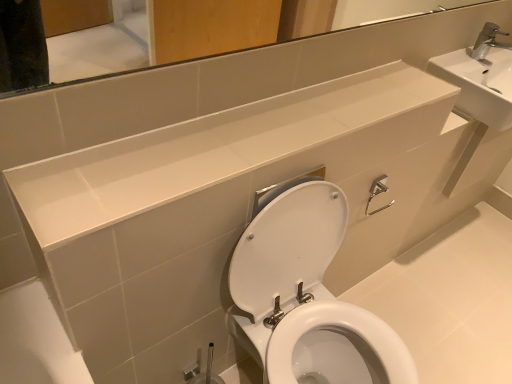
Question: Does white glossy toilet at center have a larger size compared to white glossy mirror at upper center?

Choices:
 (A) yes
 (B) no

Answer: (A)

Question: From a real-world perspective, is white glossy toilet at center positioned under white glossy mirror at upper center based on gravity?

Choices:
 (A) yes
 (B) no

Answer: (A)

Question: From the image's perspective, is white glossy toilet at center located beneath white glossy mirror at upper center?

Choices:
 (A) yes
 (B) no

Answer: (A)

Question: From the image's perspective, is white glossy toilet at center over white glossy mirror at upper center?

Choices:
 (A) no
 (B) yes

Answer: (A)

Question: Is white glossy toilet at center facing away from white glossy mirror at upper center?

Choices:
 (A) yes
 (B) no

Answer: (B)

Question: Is the position of white glossy toilet at center less distant than that of white glossy mirror at upper center?

Choices:
 (A) no
 (B) yes

Answer: (A)

Question: Does white glossy mirror at upper center appear on the left side of white glossy toilet at center?

Choices:
 (A) yes
 (B) no

Answer: (A)

Question: Is white glossy mirror at upper center placed right next to white glossy toilet at center?

Choices:
 (A) yes
 (B) no

Answer: (B)

Question: Is white glossy mirror at upper center positioned beyond the bounds of white glossy toilet at center?

Choices:
 (A) no
 (B) yes

Answer: (B)

Question: From a real-world perspective, is white glossy mirror at upper center on white glossy toilet at center?

Choices:
 (A) yes
 (B) no

Answer: (A)

Question: From the image's perspective, is white glossy mirror at upper center located above white glossy toilet at center?

Choices:
 (A) no
 (B) yes

Answer: (B)

Question: Considering the relative sizes of white glossy mirror at upper center and white glossy toilet at center in the image provided, is white glossy mirror at upper center shorter than white glossy toilet at center?

Choices:
 (A) no
 (B) yes

Answer: (A)

Question: Is white glossy mirror at upper center taller than white glossy counter top at upper center?

Choices:
 (A) yes
 (B) no

Answer: (A)